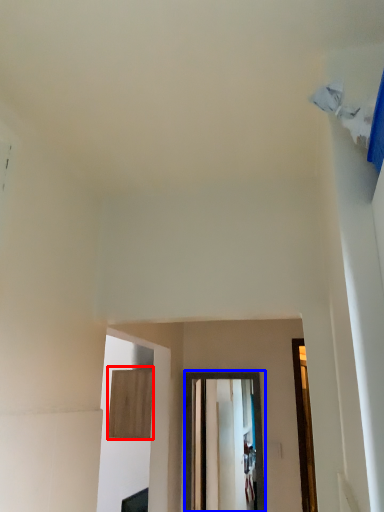
Question: Which point is closer to the camera, plywood (highlighted by a red box) or glass door (highlighted by a blue box)?

Choices:
 (A) plywood
 (B) glass door

Answer: (B)